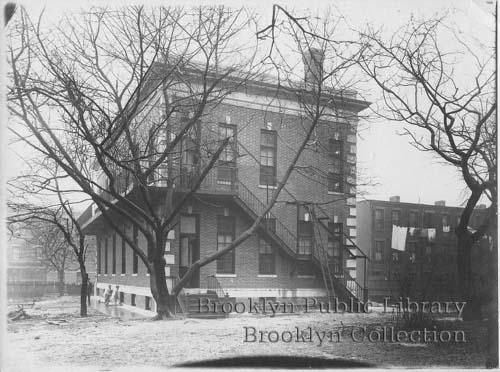
Identify the location of bottom floor front middle window. The height and width of the screenshot is (372, 500). (265, 260).